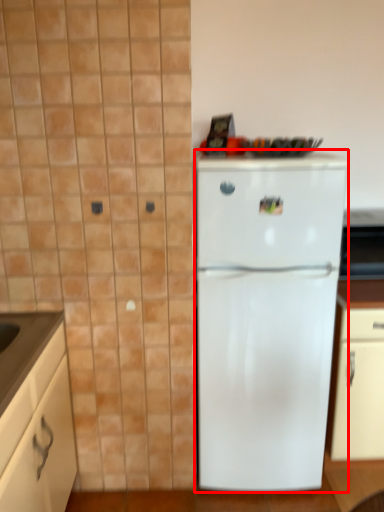
Question: From the image's perspective, where is refrigerator (annotated by the red box) located relative to cabinetry?

Choices:
 (A) below
 (B) above

Answer: (B)